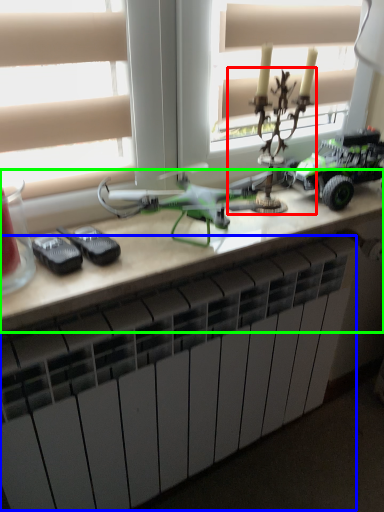
Question: Based on their relative distances, which object is nearer to toy (highlighted by a red box)? Choose from radiator (highlighted by a blue box) and table (highlighted by a green box).

Choices:
 (A) radiator
 (B) table

Answer: (B)